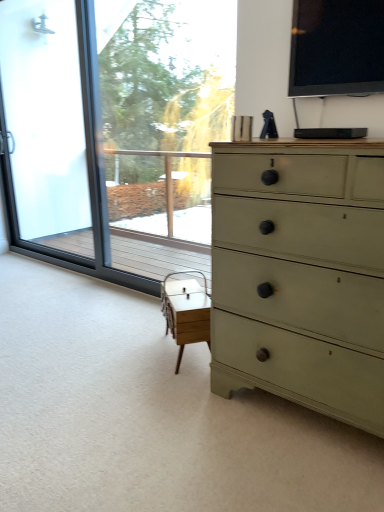
Locate an element on the screen. free location to the left of white wood table at center is located at coordinates (140, 350).